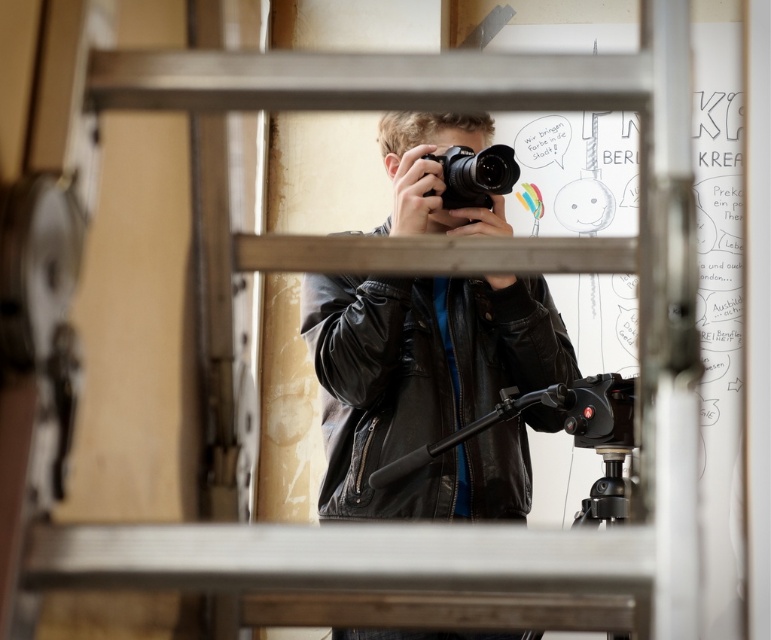
Question: Which object appears farthest from the camera in this image?

Choices:
 (A) black matte tripod at center
 (B) black leather jacket at center
 (C) black matte camera at center

Answer: (C)

Question: Can you confirm if black leather jacket at center is positioned to the left of black matte camera at center?

Choices:
 (A) yes
 (B) no

Answer: (A)

Question: Based on their relative distances, which object is farther from the black leather jacket at center?

Choices:
 (A) black matte tripod at center
 (B) black matte camera at center

Answer: (A)

Question: Is black matte tripod at center above black matte camera at center?

Choices:
 (A) no
 (B) yes

Answer: (A)

Question: Where is black leather jacket at center located in relation to black matte camera at center in the image?

Choices:
 (A) above
 (B) below

Answer: (B)

Question: Among these points, which one is farthest from the camera?

Choices:
 (A) (463, 168)
 (B) (391, 492)

Answer: (A)